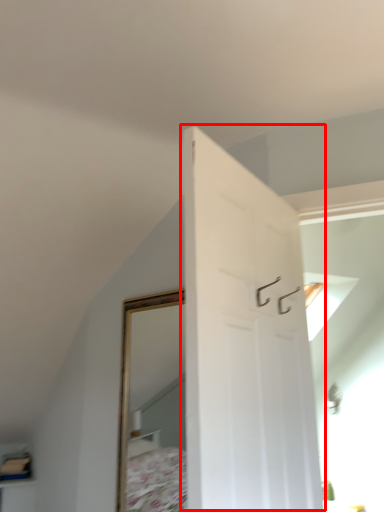
Question: From the image's perspective, where is door (annotated by the red box) located relative to shelf?

Choices:
 (A) below
 (B) above

Answer: (B)